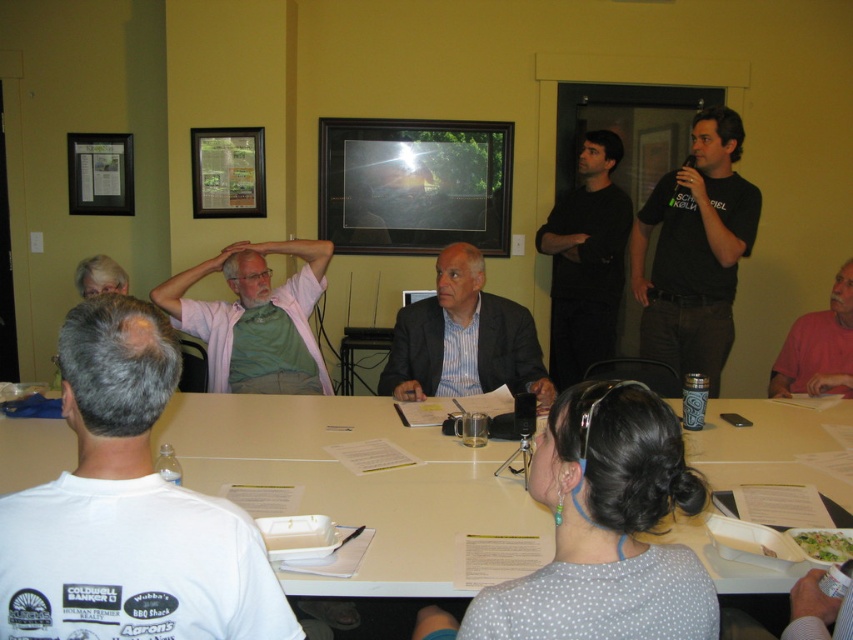
You are an interior designer assessing the wall decor in the meeting room. You notice two items on the upper left wall section. Which object is wider between the wooden framed poster at upper left and the black matte picture frame at upper left?

The wooden framed poster at upper left is wider than the black matte picture frame at upper left.

Looking at this image, you are standing in the meeting room and want to place a new item exactly where the black glossy frame at center is currently located. What are the coordinates of the spot where you should place the new item?

The coordinates for the black glossy frame at center are point (413,184), so you should place the new item there.

You are sitting at the white table and looking at the two items on the wall at the upper left corner. Which one is positioned more to the right between the wooden framed poster at upper left and the black matte picture frame at upper left?

The wooden framed poster at upper left is positioned more to the right than the black matte picture frame at upper left.